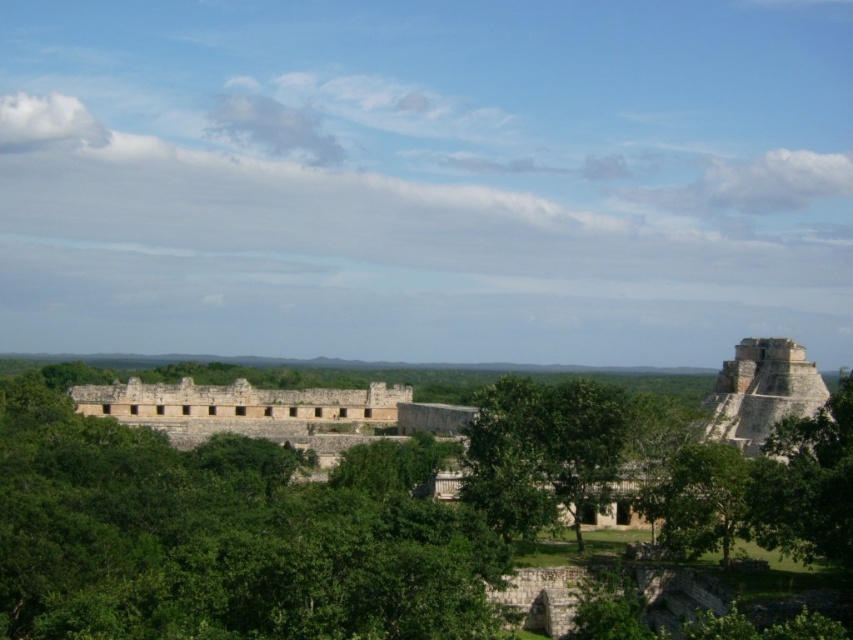
Question: Is green leafy trees at center closer to camera compared to green leafy tree at center?

Choices:
 (A) no
 (B) yes

Answer: (B)

Question: Is green leafy trees at center smaller than green leafy tree at center?

Choices:
 (A) yes
 (B) no

Answer: (B)

Question: Can you confirm if green leafy trees at center is positioned to the left of green leafy tree at center?

Choices:
 (A) yes
 (B) no

Answer: (A)

Question: Which object appears farthest from the camera in this image?

Choices:
 (A) green leafy tree at center
 (B) green leafy trees at center

Answer: (A)